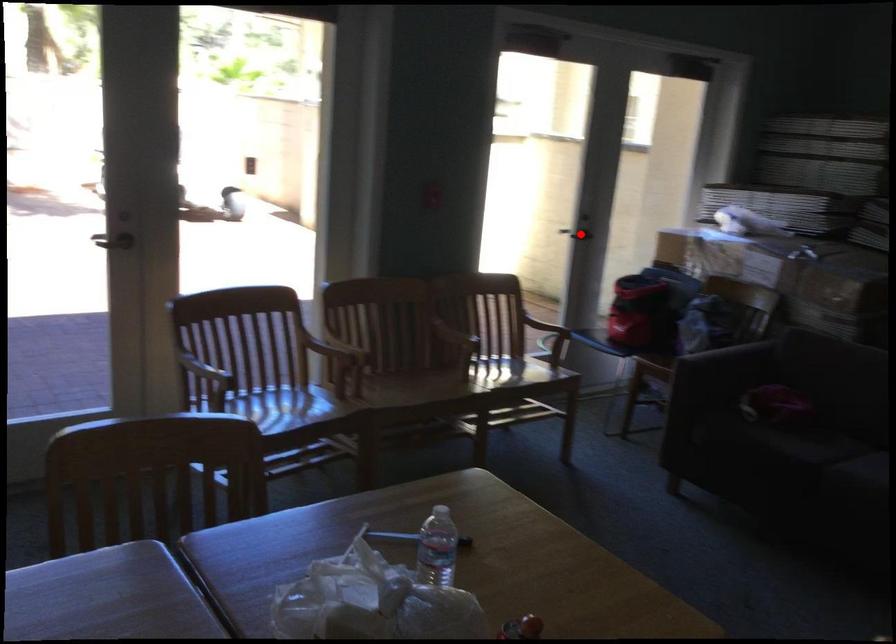
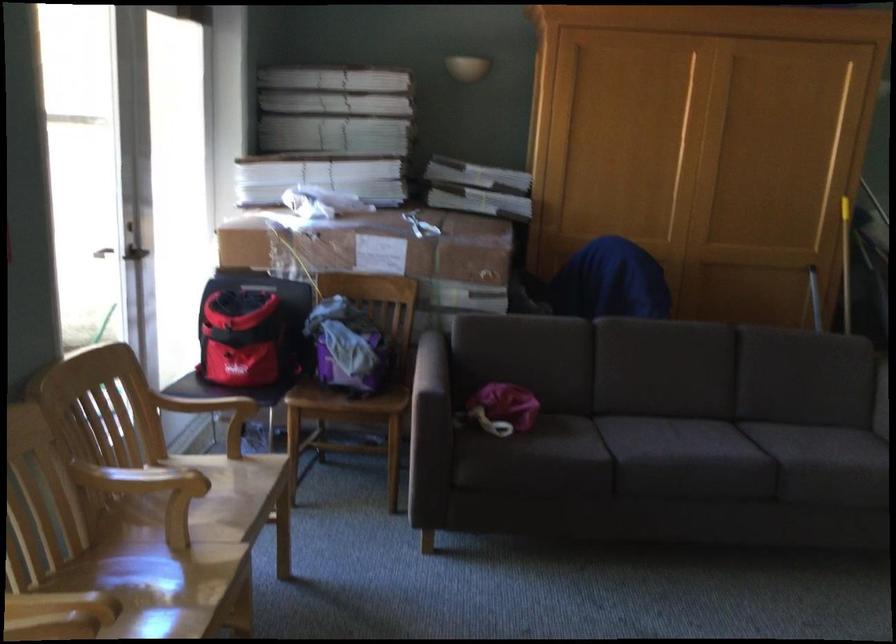
Question: I am providing you with two images of the same scene from different viewpoints. Image1 has a red point marked. In image2, the corresponding 3D location appears at what relative position? Reply with the corresponding letter.

Choices:
 (A) Closer
 (B) Farther

Answer: (A)